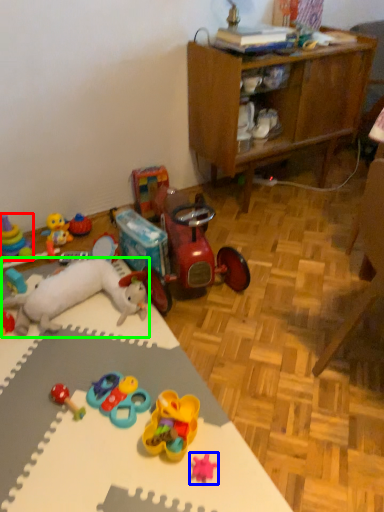
Question: Which is farther away from toy (highlighted by a red box)? toy (highlighted by a blue box) or toy (highlighted by a green box)?

Choices:
 (A) toy
 (B) toy

Answer: (A)